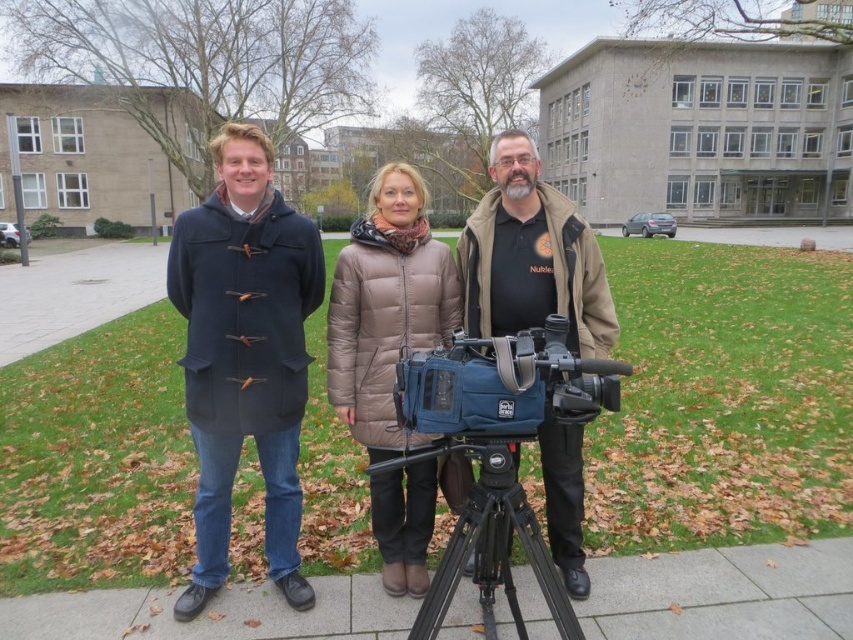
Question: Is blue fabric video camera at center below matte black camera at center?

Choices:
 (A) no
 (B) yes

Answer: (B)

Question: Is blue fabric camera at center smaller than black metal tripod at center?

Choices:
 (A) yes
 (B) no

Answer: (A)

Question: Among these points, which one is farthest from the camera?

Choices:
 (A) (578, 557)
 (B) (486, 410)

Answer: (A)

Question: Estimate the real-world distances between objects in this image. Which object is farther from the gray concrete pavement at lower center?

Choices:
 (A) blue fabric camera at center
 (B) black metal tripod at center
 (C) blue fabric video camera at center
 (D) brown quilted coat at center

Answer: (A)

Question: Can you confirm if dark blue wool coat at left is positioned above blue fabric camera at center?

Choices:
 (A) yes
 (B) no

Answer: (B)

Question: Which of these objects is positioned farthest from the black metal tripod at center?

Choices:
 (A) matte black camera at center
 (B) blue fabric video camera at center
 (C) brown quilted coat at center
 (D) brown puffer coat at center

Answer: (C)